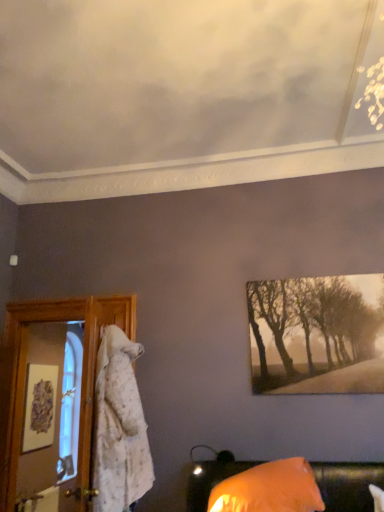
Question: Is orange fabric pillow at lower right thinner than matte white picture frame at left?

Choices:
 (A) yes
 (B) no

Answer: (B)

Question: Is orange fabric pillow at lower right shorter than matte white picture frame at left?

Choices:
 (A) no
 (B) yes

Answer: (B)

Question: Does orange fabric pillow at lower right turn towards matte white picture frame at left?

Choices:
 (A) yes
 (B) no

Answer: (B)

Question: Is orange fabric pillow at lower right wider than matte white picture frame at left?

Choices:
 (A) no
 (B) yes

Answer: (B)

Question: Would you say orange fabric pillow at lower right is outside matte white picture frame at left?

Choices:
 (A) no
 (B) yes

Answer: (B)

Question: From a real-world perspective, is orange fabric pillow at lower right below matte white picture frame at left?

Choices:
 (A) no
 (B) yes

Answer: (B)

Question: Is matte white picture frame at left located within sepia-toned canvas at upper right?

Choices:
 (A) yes
 (B) no

Answer: (B)

Question: Is sepia-toned canvas at upper right taller than matte white picture frame at left?

Choices:
 (A) yes
 (B) no

Answer: (A)

Question: Is sepia-toned canvas at upper right far from matte white picture frame at left?

Choices:
 (A) no
 (B) yes

Answer: (B)

Question: Is matte white picture frame at left at the back of sepia-toned canvas at upper right?

Choices:
 (A) no
 (B) yes

Answer: (A)

Question: Does sepia-toned canvas at upper right have a greater width compared to matte white picture frame at left?

Choices:
 (A) no
 (B) yes

Answer: (B)

Question: Does sepia-toned canvas at upper right turn towards matte white picture frame at left?

Choices:
 (A) yes
 (B) no

Answer: (B)

Question: Considering the relative sizes of matte white picture frame at left and orange fabric pillow at lower right in the image provided, is matte white picture frame at left bigger than orange fabric pillow at lower right?

Choices:
 (A) no
 (B) yes

Answer: (A)